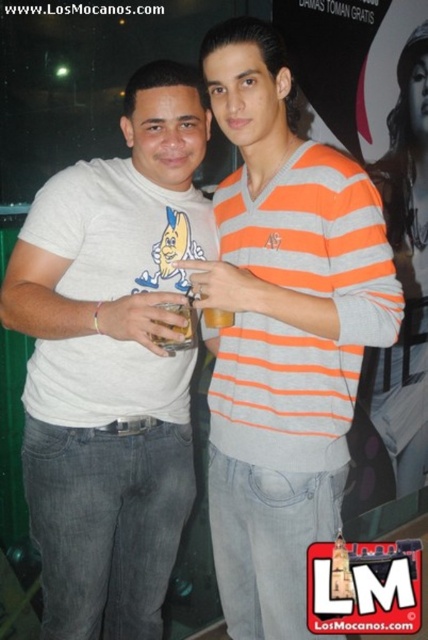
Question: Which point is closer to the camera?

Choices:
 (A) (210, 339)
 (B) (190, 307)

Answer: (B)

Question: In this image, where is white cotton t-shirt at center located relative to orange striped sweater at center?

Choices:
 (A) above
 (B) below

Answer: (B)

Question: Among these objects, which one is nearest to the camera?

Choices:
 (A) orange striped sweater at center
 (B) translucent plastic cup at center

Answer: (A)

Question: Does white cotton t-shirt at center have a greater width compared to orange striped sweater at center?

Choices:
 (A) yes
 (B) no

Answer: (A)

Question: Which point is closer to the camera taking this photo?

Choices:
 (A) (348, 385)
 (B) (124, 596)
 (C) (178, 346)

Answer: (A)

Question: In this image, where is white cotton t-shirt at center located relative to orange striped sweater at center?

Choices:
 (A) below
 (B) above

Answer: (A)